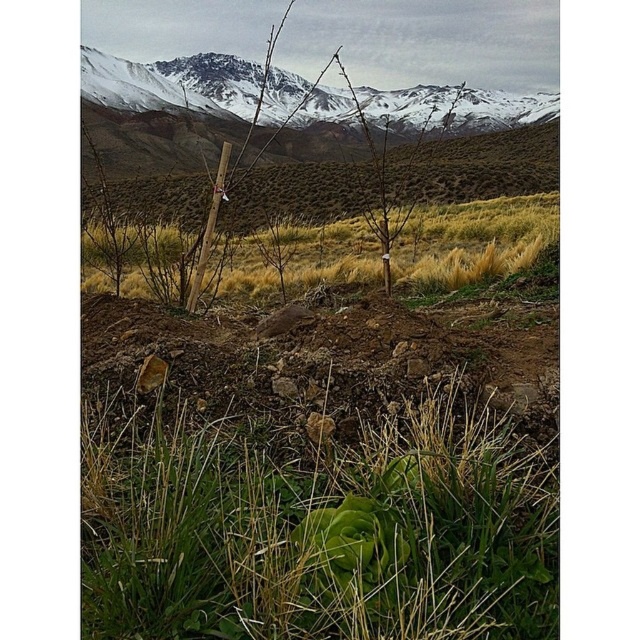
You are a hiker trying to navigate through the rugged landscape. You see the dry grass at center and the snowy rock mountain at upper center. Which of these two landmarks is smaller in size?

The dry grass at center has a smaller size compared to the snowy rock mountain at upper center, so the dry grass at center is the smaller landmark.

You are hiking in the mountains and see the green leafy grass at center and the snowy rock mountain at upper center. Which object is closer to you?

The green leafy grass at center is closer to you because it is in front of the snowy rock mountain at upper center.